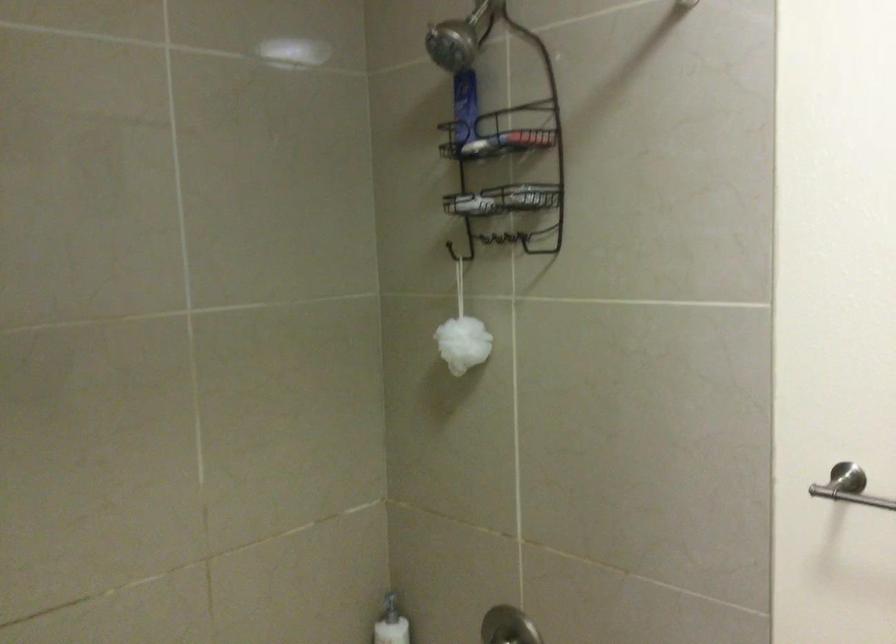
Where would you lift the white bar of soap? Please return your answer as a coordinate pair (x, y).

(464, 204)